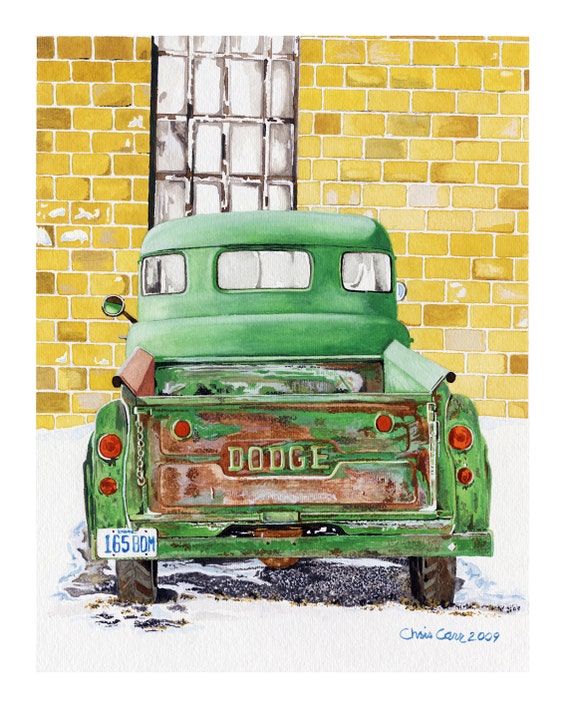
What are the coordinates of `painting` in the screenshot? It's located at (276, 280).